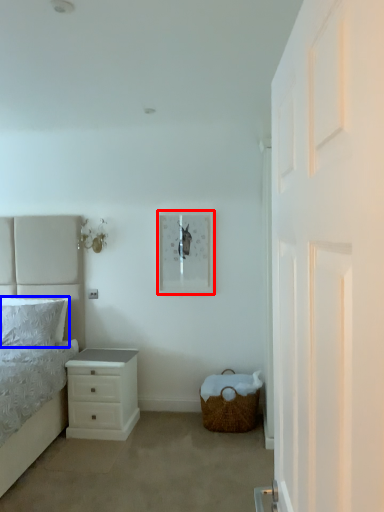
Question: Which object is closer to the camera taking this photo, picture frame (highlighted by a red box) or pillow (highlighted by a blue box)?

Choices:
 (A) picture frame
 (B) pillow

Answer: (B)